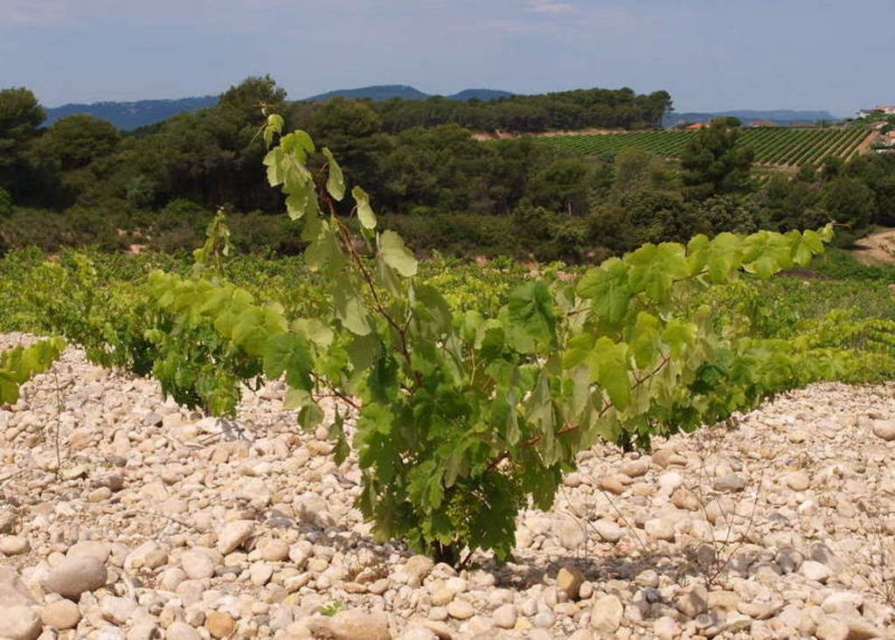
Question: Is light brown gravel at center to the right of green leafy plant at center from the viewer's perspective?

Choices:
 (A) yes
 (B) no

Answer: (A)

Question: Which of the following is the farthest from the observer?

Choices:
 (A) pyautogui.click(x=386, y=285)
 (B) pyautogui.click(x=418, y=627)

Answer: (A)

Question: Can you confirm if light brown gravel at center is wider than green leafy plant at center?

Choices:
 (A) no
 (B) yes

Answer: (A)

Question: Is light brown gravel at center bigger than green leafy plant at center?

Choices:
 (A) yes
 (B) no

Answer: (B)